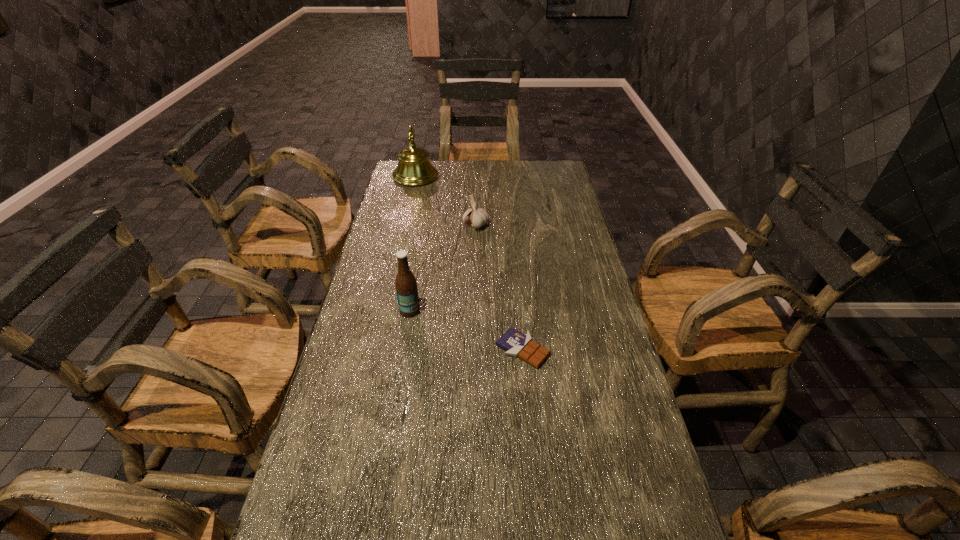
At what (x,y) coordinates should I click in order to perform the action: click on free space that satisfies the following two spatial constraints: 1. on the front side of the rightmost object; 2. on the left side of the farthest object. Please return your answer as a coordinate pair (x, y). Looking at the image, I should click on (376, 349).

What are the coordinates of `free spot that satisfies the following two spatial constraints: 1. on the back side of the beer bottle; 2. on the right side of the garlic` in the screenshot? It's located at (424, 225).

Identify the location of blank area in the image that satisfies the following two spatial constraints: 1. on the front side of the bell; 2. on the right side of the beer bottle. The image size is (960, 540). (385, 310).